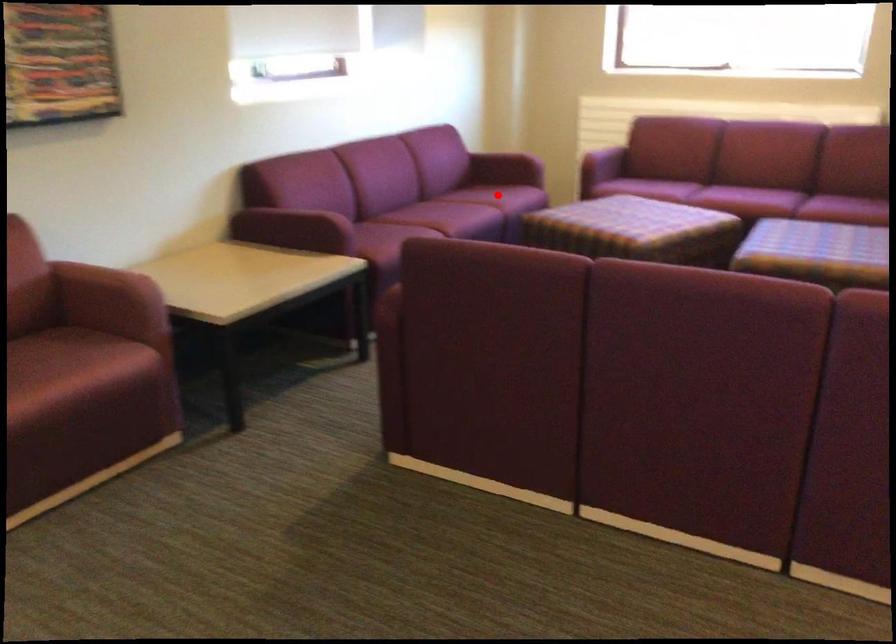
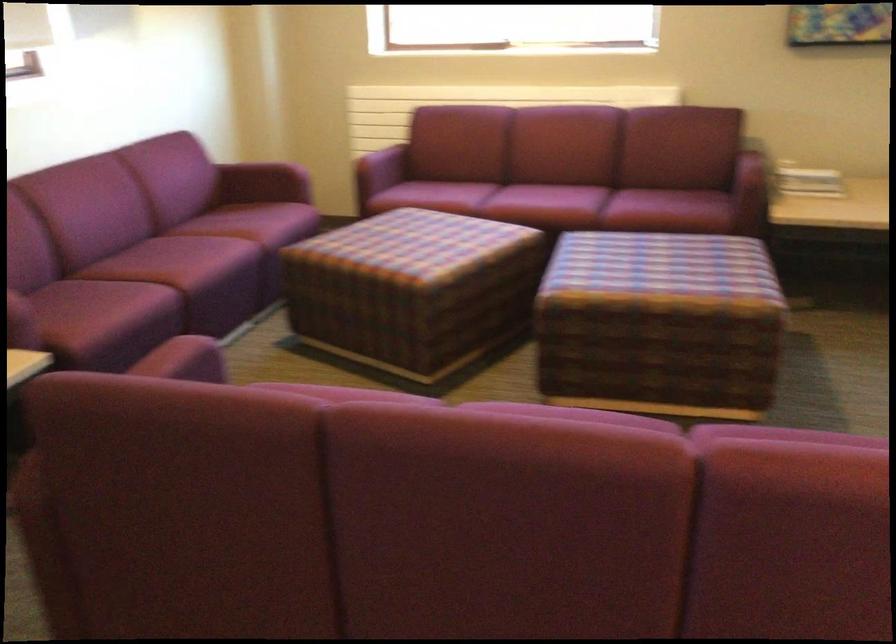
In the second image, find the point that corresponds to the highlighted location in the first image.

(254, 222)